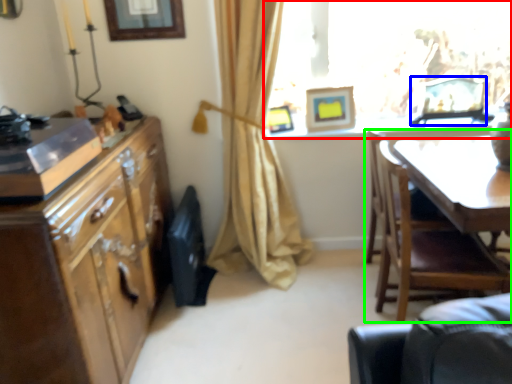
Question: Which object is the farthest from window (highlighted by a red box)? Choose among these: picture frame (highlighted by a blue box) or chair (highlighted by a green box).

Choices:
 (A) picture frame
 (B) chair

Answer: (B)